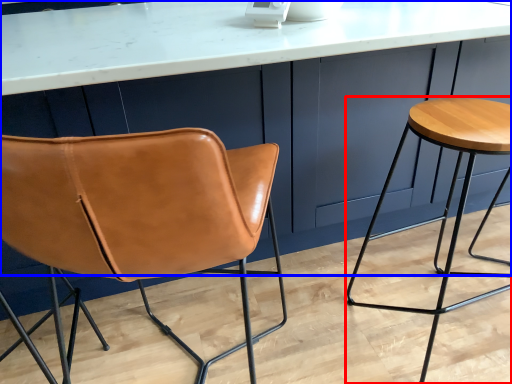
Question: Which of the following is the closest to the observer, stool (highlighted by a red box) or counter (highlighted by a blue box)?

Choices:
 (A) stool
 (B) counter

Answer: (B)